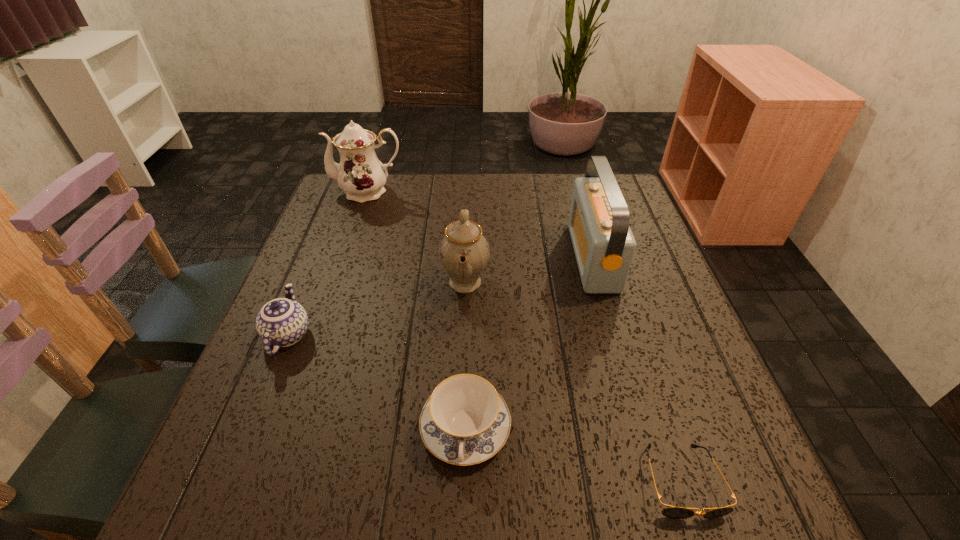
Identify the location of vacant region located 0.360m at the spout of the third tallest chinaware. (338, 213).

Locate an element on the screen. The image size is (960, 540). vacant region located 0.170m at the spout of the third tallest chinaware is located at coordinates (320, 256).

What are the coordinates of `free space located 0.230m at the spout of the third tallest chinaware` in the screenshot? It's located at click(326, 242).

At what (x,y) coordinates should I click in order to perform the action: click on object that is at the far edge. Please return your answer as a coordinate pair (x, y). The height and width of the screenshot is (540, 960). Looking at the image, I should click on (361, 175).

Identify the location of chinaware that is at the near edge. (465, 421).

The width and height of the screenshot is (960, 540). In order to click on sunglasses that is at the near edge in this screenshot , I will do tap(674, 512).

Find the location of `radio receiver that is at the right edge`. radio receiver that is at the right edge is located at coordinates (604, 245).

What are the coordinates of `sunglasses that is at the right edge` in the screenshot? It's located at (674, 512).

Identify the location of object that is at the far left corner. This screenshot has width=960, height=540. (361, 175).

I want to click on object that is at the near right corner, so click(x=674, y=512).